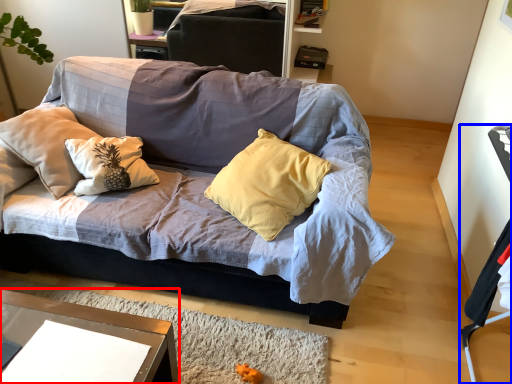
Question: Which object is further to the camera taking this photo, desk (highlighted by a red box) or armchair (highlighted by a blue box)?

Choices:
 (A) desk
 (B) armchair

Answer: (B)